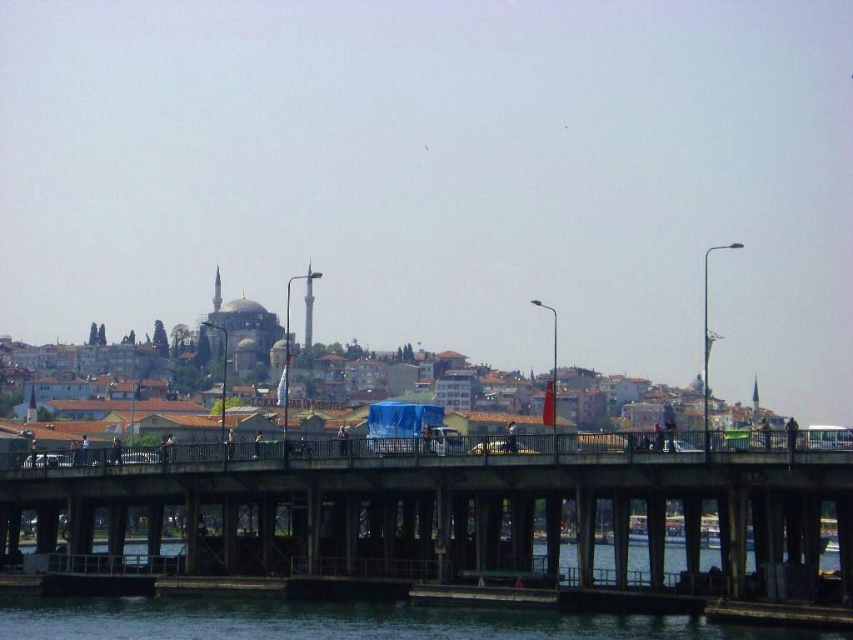
Which of these two, concrete bridge at center or transparent water at lower center, stands taller?

With more height is concrete bridge at center.

How far apart are concrete bridge at center and transparent water at lower center?

concrete bridge at center is 6.40 meters away from transparent water at lower center.

The image size is (853, 640). In order to click on concrete bridge at center in this screenshot , I will do `click(445, 509)`.